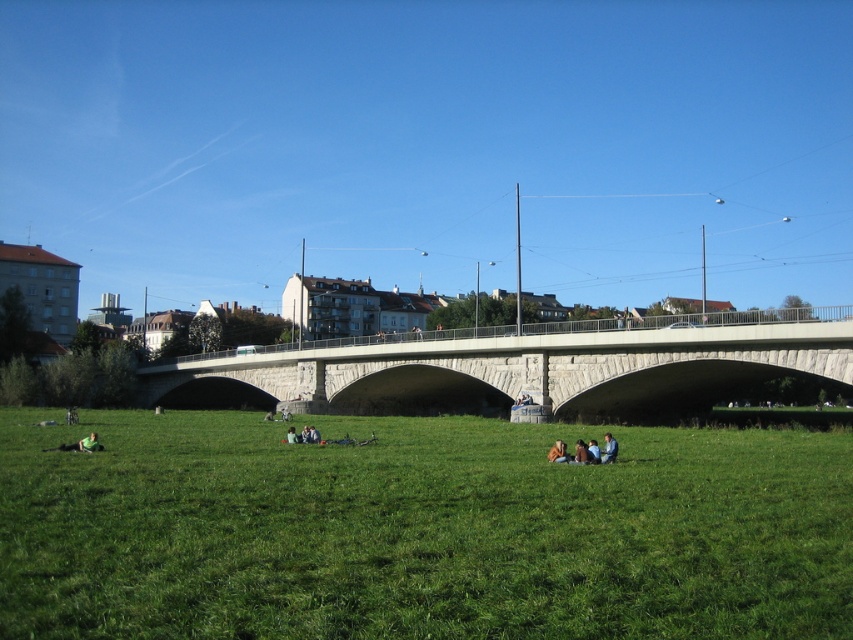
Question: Which object is closer to the camera taking this photo?

Choices:
 (A) brown leather jacket at lower center
 (B) green fabric jacket at lower center
 (C) green grassy field at lower center

Answer: (C)

Question: Is green grassy field at lower center smaller than stone bridge at center?

Choices:
 (A) no
 (B) yes

Answer: (B)

Question: Is stone bridge at center below brown leather jacket at lower center?

Choices:
 (A) no
 (B) yes

Answer: (B)

Question: Can you confirm if blue denim jeans at lower center is positioned to the right of brown leather jacket at lower center?

Choices:
 (A) yes
 (B) no

Answer: (A)

Question: Among these objects, which one is nearest to the camera?

Choices:
 (A) green fabric person at center
 (B) green grassy field at lower center
 (C) stone bridge at center
 (D) green fabric jacket at lower center

Answer: (B)

Question: Which object appears farthest from the camera in this image?

Choices:
 (A) green fabric jacket at lower center
 (B) green fabric person at center
 (C) light brown leather jacket at center
 (D) blue denim jeans at lower center

Answer: (B)